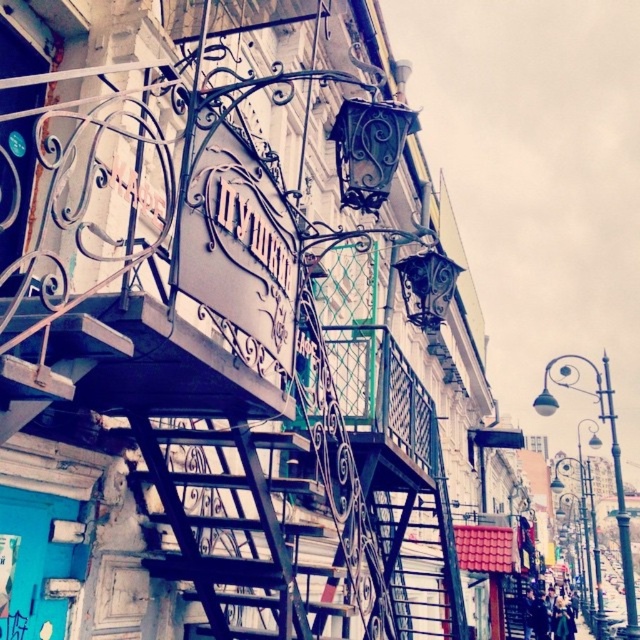
You are a maintenance worker needing to access the top platform of the black wrought iron fire escape at center. You see the rusty metal ladder at center below it. Which ladder should you climb to reach the platform?

The black wrought iron fire escape at center is located above the rusty metal ladder at center, so you should climb the rusty metal ladder at center to reach the platform.

You are a painter needing to move a 3 meter wide canvas from the ground to the platform on the black wrought iron fire escape at center. The rusty metal ladder at center is adjacent to it. Can the canvas fit through the space between the two structures?

The black wrought iron fire escape at center is wider than the rusty metal ladder at center. Since the canvas is 3 meters wide, it depends on the combined space between them. However, without specific distance data between the two structures, we cannot confirm if the canvas will fit. Please measure the gap between the black wrought iron fire escape at center and the rusty metal ladder at center first.